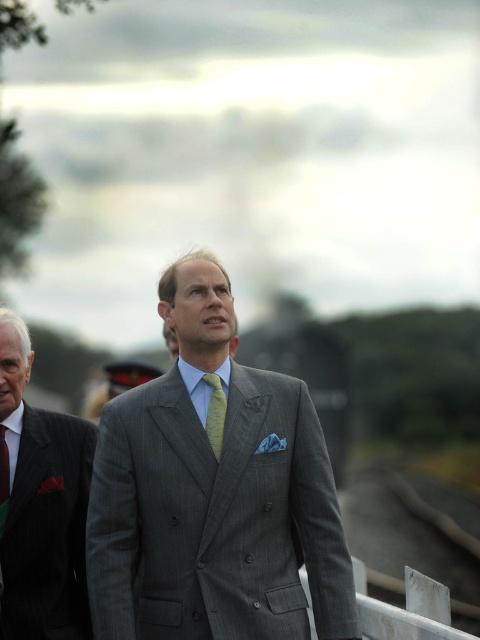
In the scene shown: You are a photographer trying to capture a photo of the white wood train track at lower right and the yellow silk tie at left in the same frame. Given that your camera has a maximum focus range of 50 feet, will you be able to include both objects in the photo without moving the camera?

The white wood train track at lower right and yellow silk tie at left are 49.44 feet apart, which is within the camera maximum focus range of 50 feet. So yes, you can include both objects in the photo without moving the camera.

You are a photographer setting up a camera to capture both the dark gray pinstripe suit at center and the yellowstriped fabrictie at center in the frame. Based on their positions, which object is wider?

The dark gray pinstripe suit at center is wider than the yellowstriped fabrictie at center according to the description.